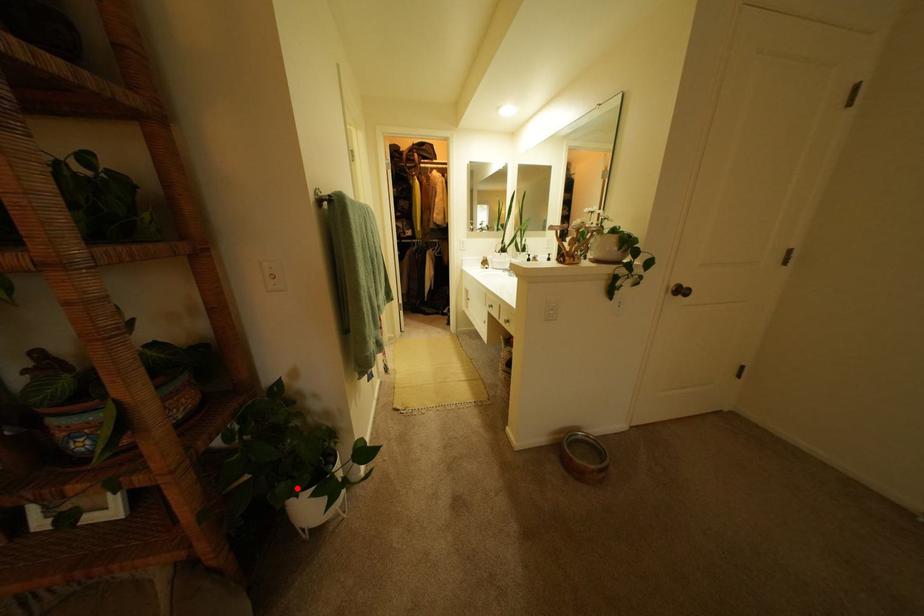
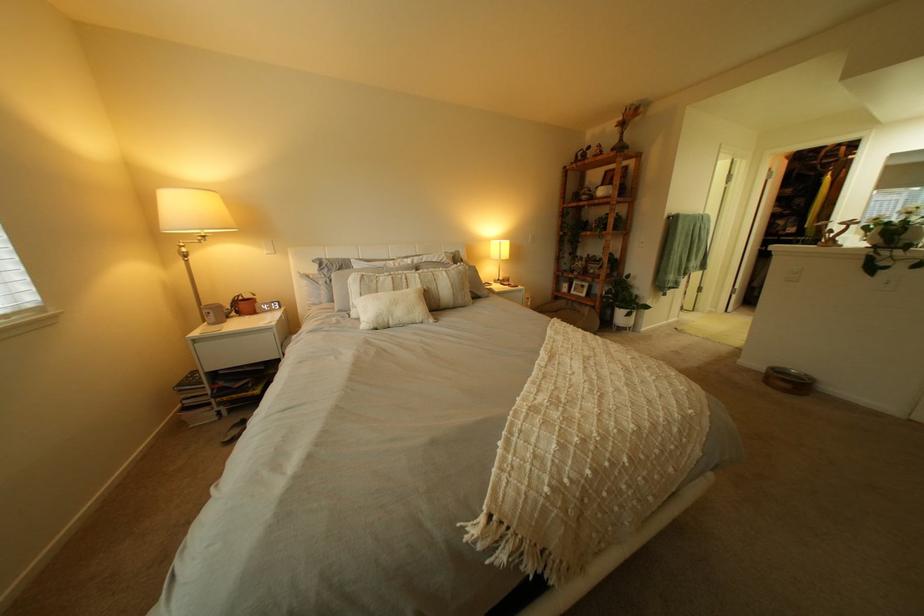
In the second image, find the point that corresponds to the highlighted location in the first image.

(633, 305)